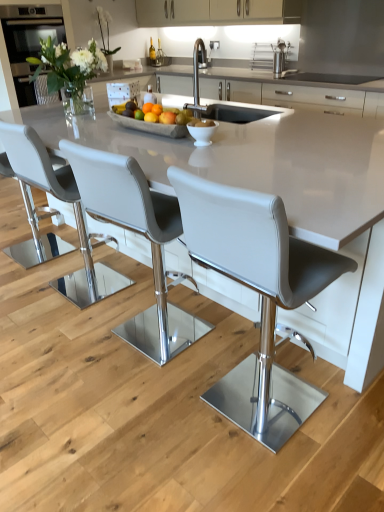
Where is `vacant space in front of white leather chair at left, positioned as the 2th chair in left-to-right order`? The height and width of the screenshot is (512, 384). vacant space in front of white leather chair at left, positioned as the 2th chair in left-to-right order is located at coordinates (62, 330).